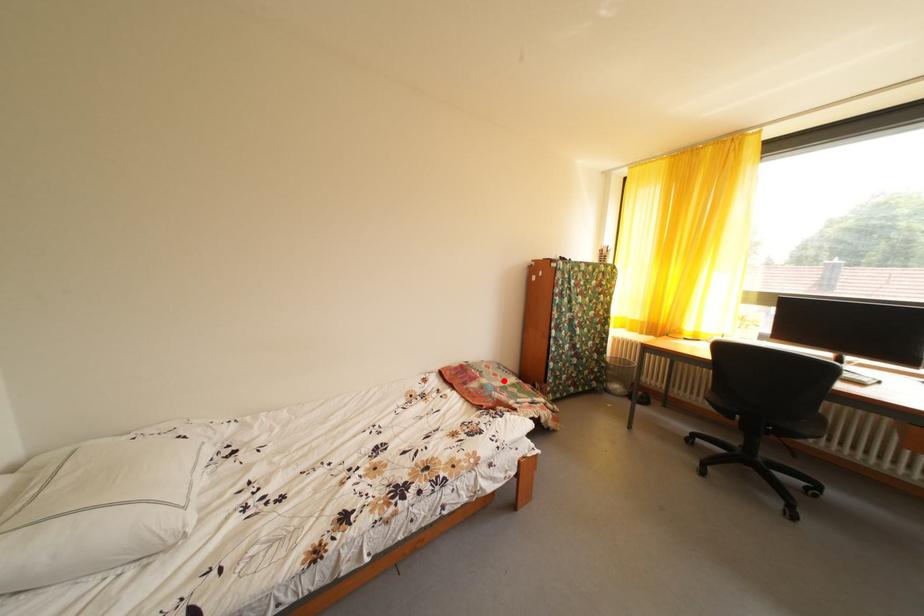
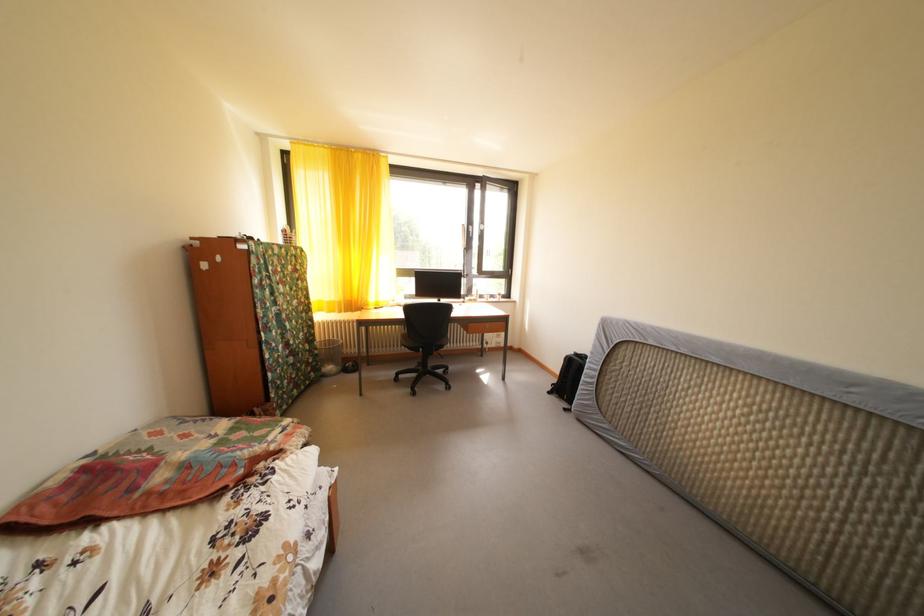
Locate, in the second image, the point that corresponds to the highlighted location in the first image.

(195, 442)